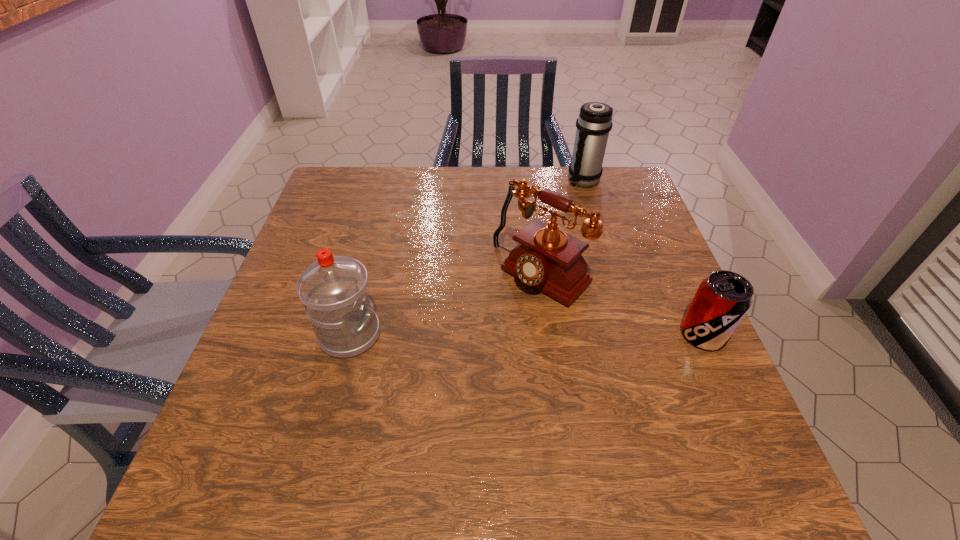
Find the location of a particular element. The image size is (960, 540). the leftmost object is located at coordinates (334, 289).

Identify the location of the shortest object. (722, 299).

Find the location of a particular element. Image resolution: width=960 pixels, height=540 pixels. soda can is located at coordinates (722, 299).

This screenshot has height=540, width=960. I want to click on telephone, so pyautogui.click(x=550, y=260).

At what (x,y) coordinates should I click in order to perform the action: click on the second object from left to right. Please return your answer as a coordinate pair (x, y). The height and width of the screenshot is (540, 960). Looking at the image, I should click on (550, 260).

Locate an element on the screen. The image size is (960, 540). thermos bottle is located at coordinates (594, 123).

The image size is (960, 540). Find the location of `the second object from right to left`. the second object from right to left is located at coordinates (594, 123).

Identify the location of free region located 0.090m on the handle side of the water bottle. (422, 334).

Identify the location of free location located 0.070m on the front of the rightmost object. The image size is (960, 540). (725, 382).

What are the coordinates of `free region located on the dial of the third object from right to left` in the screenshot? It's located at coord(444,366).